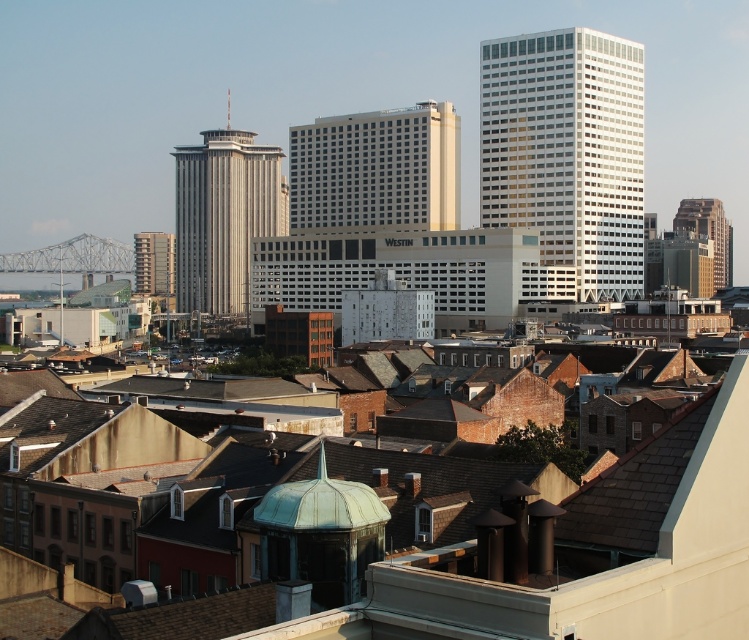
Question: Based on their relative distances, which object is farther from the silver metallic skyscraper at center?

Choices:
 (A) green copper dome at center
 (B) matte gray building at center
 (C) white glass skyscraper at upper right
 (D) matte glass hotel at center

Answer: (A)

Question: Can you confirm if silver metallic skyscraper at center is positioned to the left of gold glass skyscraper at right?

Choices:
 (A) no
 (B) yes

Answer: (B)

Question: Can you confirm if white glass skyscraper at upper right is positioned to the right of silver metallic skyscraper at center?

Choices:
 (A) yes
 (B) no

Answer: (A)

Question: Can you confirm if matte glass hotel at center is positioned to the left of matte gray building at center?

Choices:
 (A) yes
 (B) no

Answer: (B)

Question: Which point is closer to the camera taking this photo?

Choices:
 (A) (554, 35)
 (B) (703, 230)
 (C) (172, 253)

Answer: (A)

Question: Which of the following is the closest to the observer?

Choices:
 (A) matte gray building at center
 (B) silver metallic skyscraper at center
 (C) matte glass hotel at center
 (D) gold glass skyscraper at right

Answer: (C)